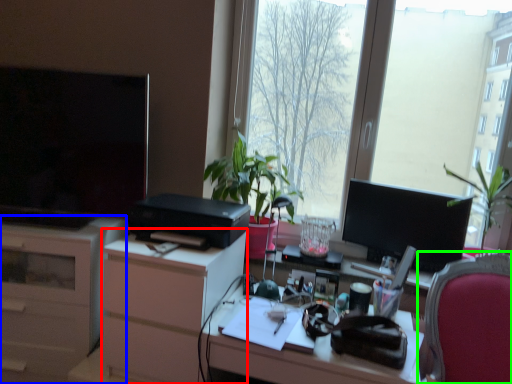
Question: Which object is the closest to the dresser (highlighted by a red box)? Choose among these: cabinetry (highlighted by a blue box) or chair (highlighted by a green box).

Choices:
 (A) cabinetry
 (B) chair

Answer: (A)